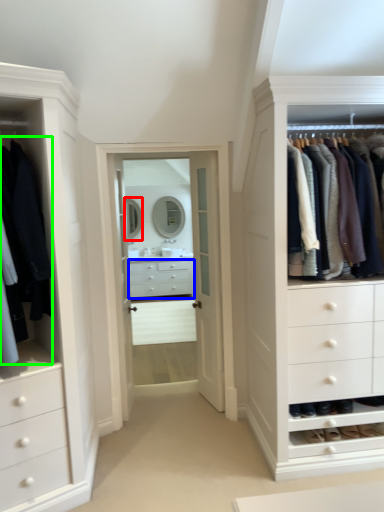
Question: Based on their relative distances, which object is nearer to mirror (highlighted by a red box)? Choose from drawer (highlighted by a blue box) and clothing (highlighted by a green box).

Choices:
 (A) drawer
 (B) clothing

Answer: (A)